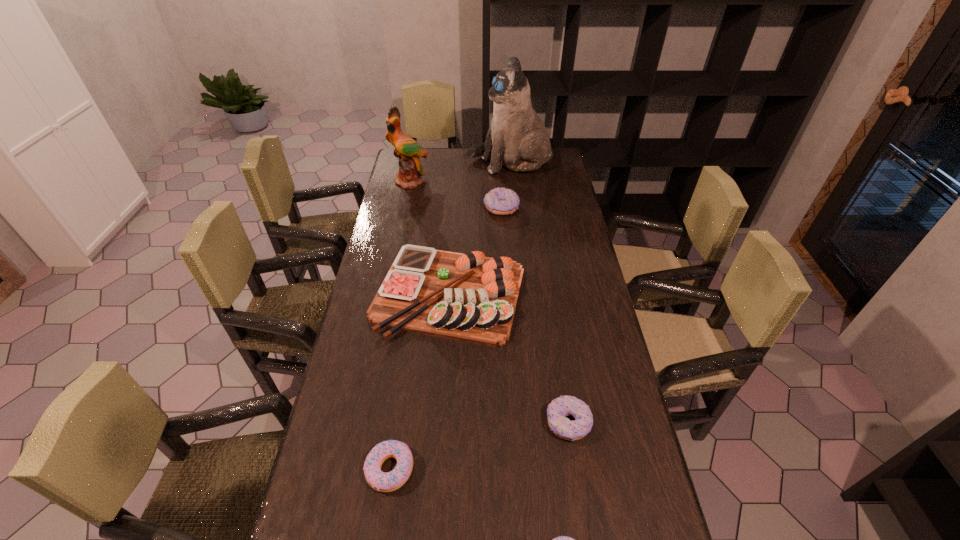
Point out which doughnut is positioned as the second nearest to the shortest object. Please provide its 2D coordinates. Your answer should be formatted as a tuple, i.e. [(x, y)], where the tuple contains the x and y coordinates of a point satisfying the conditions above.

[(383, 482)]

Identify the location of brown doughnut identified as the closest to the shortest object. The height and width of the screenshot is (540, 960). (559, 408).